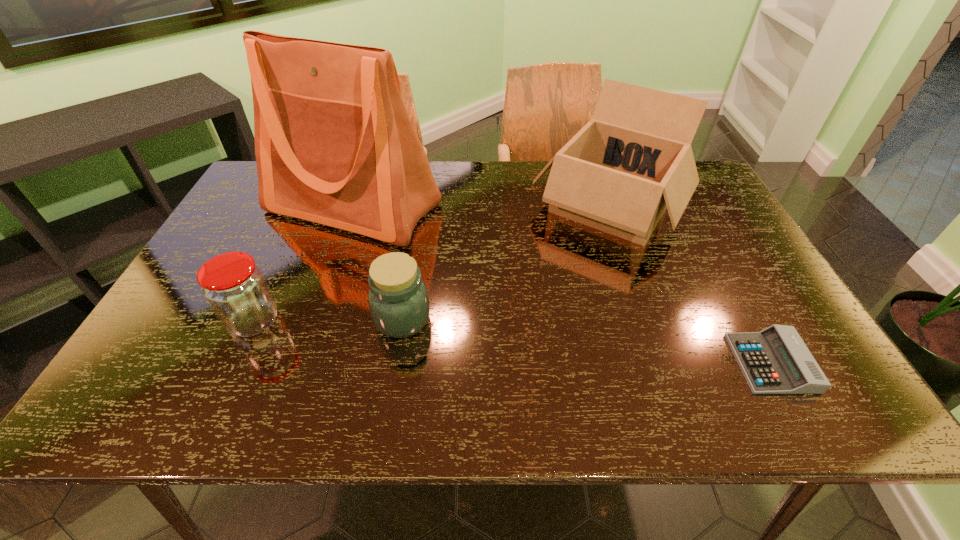
Locate an element on the screen. This screenshot has height=540, width=960. free location that satisfies the following two spatial constraints: 1. on the front side of the shopping bag; 2. on the left side of the right jar is located at coordinates (316, 319).

At what (x,y) coordinates should I click in order to perform the action: click on blank space that satisfies the following two spatial constraints: 1. on the back side of the left jar; 2. on the right side of the box. Please return your answer as a coordinate pair (x, y). The height and width of the screenshot is (540, 960). Looking at the image, I should click on (308, 206).

You are a GUI agent. You are given a task and a screenshot of the screen. Output one action in this format:
    pyautogui.click(x=<x>, y=<y>)
    Task: Click on the free location that satisfies the following two spatial constraints: 1. on the front side of the tallest object; 2. on the right side of the shortest object
    The width and height of the screenshot is (960, 540).
    Given the screenshot: What is the action you would take?
    pyautogui.click(x=300, y=363)